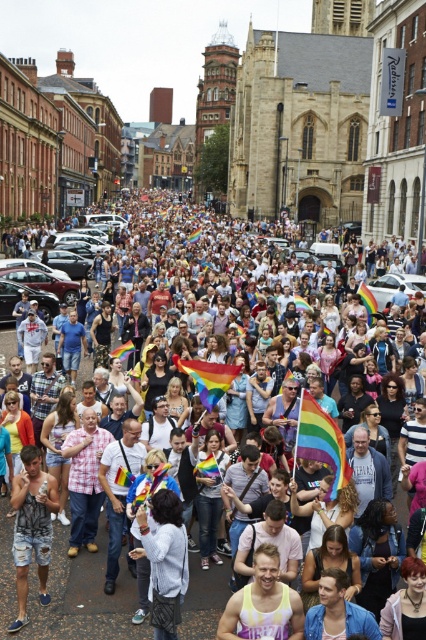
Question: Which object appears closest to the camera in this image?

Choices:
 (A) white cotton shirt at center
 (B) ripped denim shorts at lower left
 (C) rainbow flag at center

Answer: (A)

Question: Which of the following is the closest to the observer?

Choices:
 (A) (233, 618)
 (B) (42, 557)
 (C) (83, 358)
 (D) (169, 490)

Answer: (A)

Question: Does ripped denim shorts at lower left appear under rainbow tie-dye tank top at center?

Choices:
 (A) no
 (B) yes

Answer: (A)

Question: Which point appears closest to the camera in this image?

Choices:
 (A) (66, 579)
 (B) (241, 627)
 (C) (178, 552)
 (D) (20, 556)

Answer: (B)

Question: Is rainbow tie-dye tank top at center smaller than white cotton shirt at center?

Choices:
 (A) no
 (B) yes

Answer: (B)

Question: Does rainbow flag at center appear over ripped denim shorts at lower left?

Choices:
 (A) no
 (B) yes

Answer: (B)